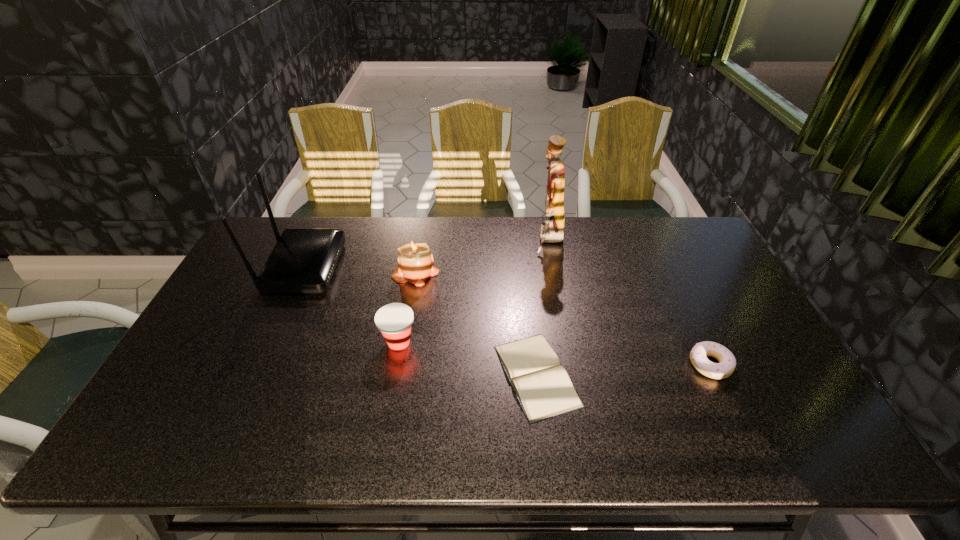
Locate an element on the screen. free space between the third tallest object and the nutcracker is located at coordinates (483, 256).

Locate an element on the screen. Image resolution: width=960 pixels, height=540 pixels. vacant area between the fourth tallest object and the Bible is located at coordinates point(468,359).

You are a GUI agent. You are given a task and a screenshot of the screen. Output one action in this format:
    pyautogui.click(x=<x>, y=<y>)
    Task: Click on the free space between the Dixie cup and the router
    This screenshot has height=540, width=960.
    Given the screenshot: What is the action you would take?
    pyautogui.click(x=351, y=305)

In order to click on vacant space that is in between the Bible and the nutcracker in this screenshot , I will do `click(542, 308)`.

Identify the location of unoccupied area between the second shortest object and the tallest object. tap(630, 302).

Locate an element on the screen. The height and width of the screenshot is (540, 960). object that is the fourth closest to the shortest object is located at coordinates (551, 231).

The image size is (960, 540). I want to click on object that is the closest to the doughnut, so click(x=542, y=386).

At what (x,y) coordinates should I click in order to perform the action: click on free spot that satisfies the following two spatial constraints: 1. on the back side of the second shortest object; 2. on the left side of the Bible. Please return your answer as a coordinate pair (x, y). The height and width of the screenshot is (540, 960). Looking at the image, I should click on (535, 364).

Find the location of a particular element. This screenshot has width=960, height=540. vacant position in the image that satisfies the following two spatial constraints: 1. on the front side of the fourth tallest object; 2. on the right side of the second shortest object is located at coordinates 395,364.

Identify the location of free spot that satisfies the following two spatial constraints: 1. on the front-facing side of the router; 2. on the back side of the candle. (300, 272).